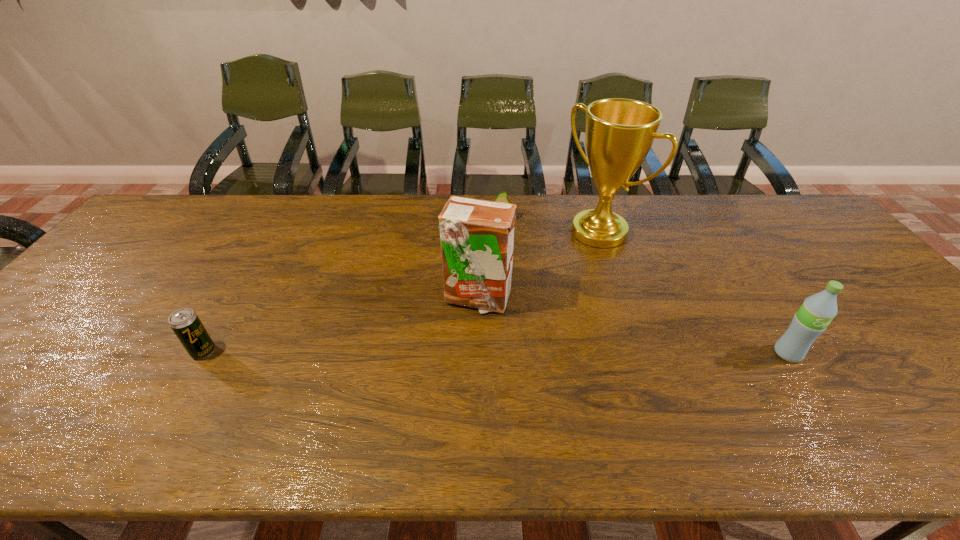
You are a GUI agent. You are given a task and a screenshot of the screen. Output one action in this format:
    pyautogui.click(x=<x>, y=<y>)
    Task: Click on the free space between the avocado and the beer can
    Image resolution: width=960 pixels, height=540 pixels.
    Given the screenshot: What is the action you would take?
    pyautogui.click(x=351, y=285)

This screenshot has height=540, width=960. Identify the location of vacant space that is in between the award and the avocado. (549, 225).

Identify which object is the fourth closest to the second object from right to left. Please provide its 2D coordinates. Your answer should be formatted as a tuple, i.e. [(x, y)], where the tuple contains the x and y coordinates of a point satisfying the conditions above.

[(185, 323)]

Identify which object is the closest to the beer can. Please provide its 2D coordinates. Your answer should be formatted as a tuple, i.e. [(x, y)], where the tuple contains the x and y coordinates of a point satisfying the conditions above.

[(477, 236)]

Locate an element on the screen. vacant area in the image that satisfies the following two spatial constraints: 1. on the back side of the leftmost object; 2. on the left side of the avocado is located at coordinates (281, 219).